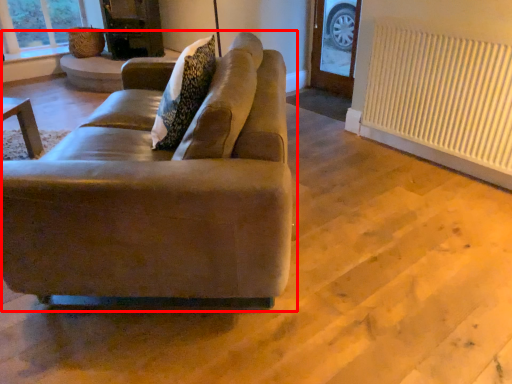
Question: From the image's perspective, what is the correct spatial relationship of studio couch (annotated by the red box) in relation to radiator?

Choices:
 (A) below
 (B) above

Answer: (A)